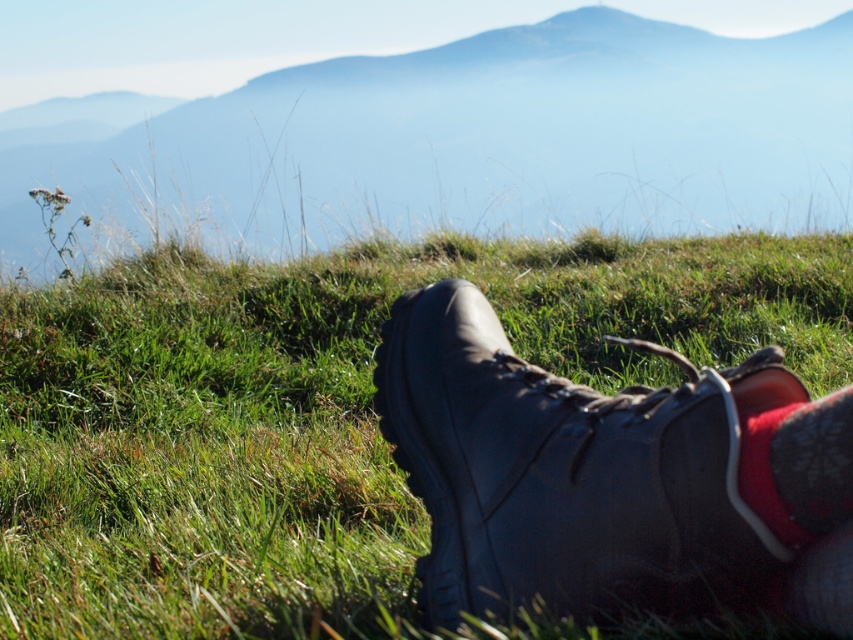
Consider the image. You are planning to pack your hiking gear and have both the leather boot at lower center and the red suede sock at lower right in your bag. If you want to place them side by side in your backpack compartment, which one should you place first to ensure they both fit properly?

The leather boot at lower center is larger in size compared to the red suede sock at lower right. Therefore, you should place the leather boot at lower center first to ensure both items fit properly in the backpack compartment.

You are standing at the top of a hill looking down at the scene. You notice two patches of green grass at lower center and green grass at lower left. Which patch of grass is positioned lower in the image?

The green grass at lower center is positioned lower in the image than the green grass at lower left.